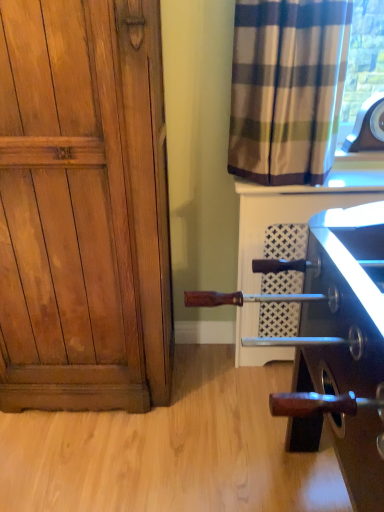
Locate an element on the screen. This screenshot has width=384, height=512. free spot above wooden handle at lower right (from a real-world perspective) is located at coordinates (181, 426).